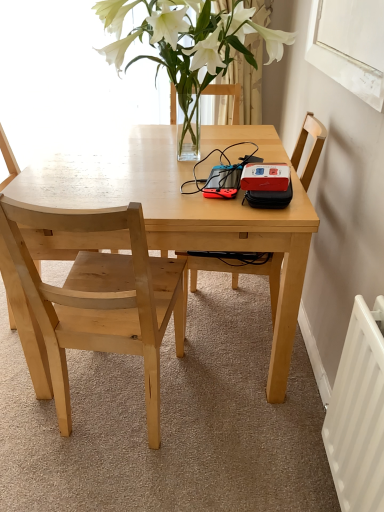
Find the location of a particular element. vacant area that is in front of light wood chair at left, positioned as the 2th chair in left-to-right order is located at coordinates (117, 478).